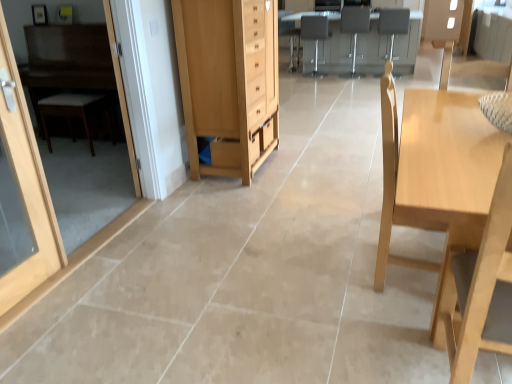
Question: Is matte gray armchair at upper center, positioned as the third armchair in left-to-right order, inside the boundaries of transparent glass door at left, which is the 2th screen door in back-to-front order, or outside?

Choices:
 (A) outside
 (B) inside

Answer: (A)

Question: From a real-world perspective, is matte gray armchair at upper center, arranged as the first armchair when viewed from the right, above or below transparent glass door at left, which is the 2th screen door in back-to-front order?

Choices:
 (A) below
 (B) above

Answer: (A)

Question: Considering the real-world distances, which object is closest to the transparent glass door at left, which is the 2th screen door in back-to-front order?

Choices:
 (A) white glossy screen door at left, the 2th screen door positioned from the front
 (B) wooden drawer at center
 (C) matte gray armchair at upper center, arranged as the first armchair when viewed from the right
 (D) light wood table at right, acting as the second table starting from the back
 (E) white woven stool at left

Answer: (E)

Question: Estimate the real-world distances between objects in this image. Which object is closer to the white glossy screen door at left, the 2th screen door positioned from the front?

Choices:
 (A) light wood chair at right
 (B) matte gray armchair at center, the 2th armchair viewed from the right
 (C) light wood table at right, acting as the second table starting from the back
 (D) matte gray armchair at upper center, arranged as the first armchair when viewed from the right
 (E) wooden drawer at center

Answer: (E)